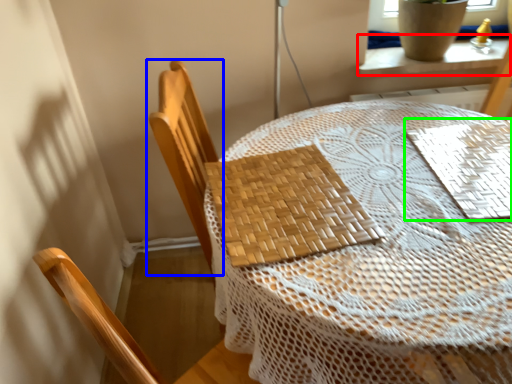
Question: Estimate the real-world distances between objects in this image. Which object is closer to window sill (highlighted by a red box), chair (highlighted by a blue box) or mat (highlighted by a green box)?

Choices:
 (A) chair
 (B) mat

Answer: (B)